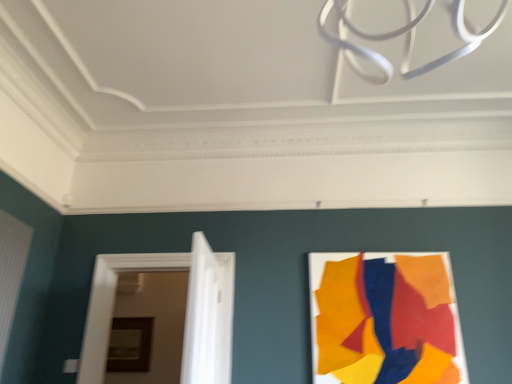
Question: Should I look upward or downward to see white glossy door at center, marked as the first door in a front-to-back arrangement?

Choices:
 (A) down
 (B) up

Answer: (A)

Question: From the image's perspective, does matte acrylic poster at right appear higher than white painted wood door at left, which ranks as the second door in front-to-back order?

Choices:
 (A) yes
 (B) no

Answer: (A)

Question: Can you confirm if matte acrylic poster at right is wider than white painted wood door at left, which ranks as the second door in front-to-back order?

Choices:
 (A) yes
 (B) no

Answer: (B)

Question: Is matte acrylic poster at right touching white painted wood door at left, which ranks as the second door in front-to-back order?

Choices:
 (A) no
 (B) yes

Answer: (A)

Question: From a real-world perspective, is matte acrylic poster at right on white painted wood door at left, which ranks as the second door in front-to-back order?

Choices:
 (A) yes
 (B) no

Answer: (A)

Question: Is matte acrylic poster at right positioned in front of white painted wood door at left, which ranks as the second door in front-to-back order?

Choices:
 (A) yes
 (B) no

Answer: (A)

Question: Can you confirm if matte acrylic poster at right is positioned to the right of white painted wood door at left, acting as the first door starting from the back?

Choices:
 (A) yes
 (B) no

Answer: (A)

Question: Can you see white glossy door at center, marked as the second door in a back-to-front arrangement, touching wooden picture frame at center?

Choices:
 (A) yes
 (B) no

Answer: (B)

Question: Is white glossy door at center, marked as the first door in a front-to-back arrangement, not close to wooden picture frame at center?

Choices:
 (A) no
 (B) yes

Answer: (B)

Question: Is white glossy door at center, marked as the first door in a front-to-back arrangement, not inside wooden picture frame at center?

Choices:
 (A) yes
 (B) no

Answer: (A)

Question: From a real-world perspective, is white glossy door at center, marked as the first door in a front-to-back arrangement, located higher than wooden picture frame at center?

Choices:
 (A) yes
 (B) no

Answer: (A)

Question: Does white glossy door at center, marked as the second door in a back-to-front arrangement, have a lesser width compared to wooden picture frame at center?

Choices:
 (A) yes
 (B) no

Answer: (B)

Question: Is white glossy door at center, marked as the second door in a back-to-front arrangement, taller than wooden picture frame at center?

Choices:
 (A) yes
 (B) no

Answer: (A)

Question: From a real-world perspective, is white painted wood door at left, which ranks as the second door in front-to-back order, located higher than matte acrylic poster at right?

Choices:
 (A) no
 (B) yes

Answer: (A)